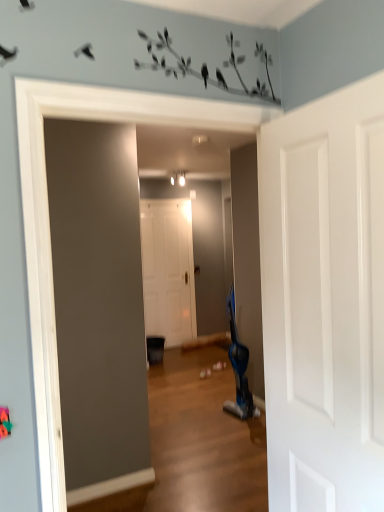
Question: Can you confirm if blue plastic swivel chair at center-right is smaller than white matte door at center, the second door from the right?

Choices:
 (A) yes
 (B) no

Answer: (A)

Question: Is blue plastic swivel chair at center-right to the right of white matte door at center, which is the 1th door in left-to-right order, from the viewer's perspective?

Choices:
 (A) yes
 (B) no

Answer: (A)

Question: From the image's perspective, does blue plastic swivel chair at center-right appear lower than white matte door at center, the second door from the right?

Choices:
 (A) no
 (B) yes

Answer: (B)

Question: Is blue plastic swivel chair at center-right further to camera compared to white matte door at center, the second door from the right?

Choices:
 (A) no
 (B) yes

Answer: (A)

Question: Does blue plastic swivel chair at center-right have a greater width compared to white matte door at center, which ranks as the 2th door in front-to-back order?

Choices:
 (A) no
 (B) yes

Answer: (B)

Question: From a real-world perspective, does blue plastic swivel chair at center-right stand above white matte door at center, the second door from the right?

Choices:
 (A) yes
 (B) no

Answer: (B)

Question: Is blue plastic swivel chair at center-right positioned far away from white glossy door at upper right, marked as the first door in a right-to-left arrangement?

Choices:
 (A) no
 (B) yes

Answer: (B)

Question: Is blue plastic swivel chair at center-right positioned beyond the bounds of white glossy door at upper right, positioned as the second door in left-to-right order?

Choices:
 (A) yes
 (B) no

Answer: (A)

Question: Is blue plastic swivel chair at center-right behind white glossy door at upper right, marked as the first door in a right-to-left arrangement?

Choices:
 (A) yes
 (B) no

Answer: (A)

Question: Considering the relative sizes of blue plastic swivel chair at center-right and white glossy door at upper right, marked as the first door in a right-to-left arrangement, in the image provided, is blue plastic swivel chair at center-right bigger than white glossy door at upper right, marked as the first door in a right-to-left arrangement,?

Choices:
 (A) yes
 (B) no

Answer: (A)

Question: From a real-world perspective, is blue plastic swivel chair at center-right physically above white glossy door at upper right, marked as the first door in a right-to-left arrangement?

Choices:
 (A) yes
 (B) no

Answer: (B)

Question: Is blue plastic swivel chair at center-right looking in the opposite direction of white glossy door at upper right, which ranks as the second door in back-to-front order?

Choices:
 (A) yes
 (B) no

Answer: (B)

Question: Can you confirm if white matte door at center, which is the 1th door in left-to-right order, is wider than blue plastic swivel chair at center-right?

Choices:
 (A) no
 (B) yes

Answer: (A)